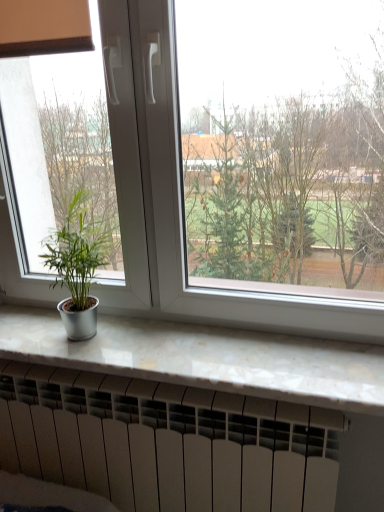
Question: Considering the positions of white marble counter top at lower center and white plastic window at center in the image, is white marble counter top at lower center wider or thinner than white plastic window at center?

Choices:
 (A) thin
 (B) wide

Answer: (B)

Question: From their relative heights in the image, would you say white marble counter top at lower center is taller or shorter than white plastic window at center?

Choices:
 (A) tall
 (B) short

Answer: (B)

Question: Estimate the real-world distances between objects in this image. Which object is closer to the white plastic window at center?

Choices:
 (A) white matte heater at bottom
 (B) green matte plant at left
 (C) white marble counter top at lower center

Answer: (B)

Question: Based on their relative distances, which object is nearer to the white marble counter top at lower center?

Choices:
 (A) green matte plant at left
 (B) white plastic window at center
 (C) white matte heater at bottom

Answer: (B)